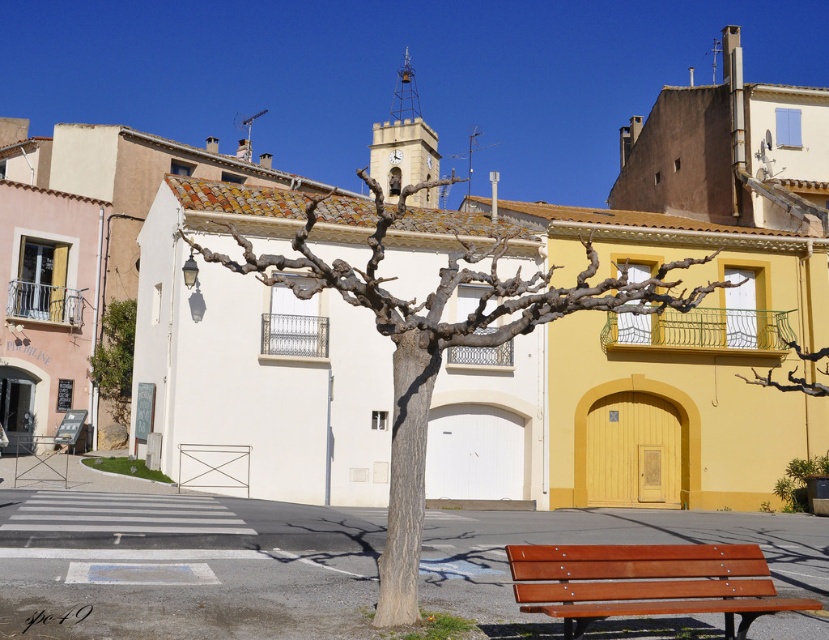
Question: Does brown wooden bench at lower right have a smaller size compared to green leafy tree at left?

Choices:
 (A) yes
 (B) no

Answer: (A)

Question: Based on their relative distances, which object is farther from the green leafy tree at left?

Choices:
 (A) bare wood tree at center
 (B) brown wooden bench at lower right

Answer: (B)

Question: Does brown wooden bench at lower right have a greater width compared to green leafy tree at left?

Choices:
 (A) no
 (B) yes

Answer: (B)

Question: Can you confirm if brown wooden bench at lower right is positioned to the right of green leafy tree at left?

Choices:
 (A) yes
 (B) no

Answer: (A)

Question: Which point is farther to the camera?

Choices:
 (A) green leafy tree at left
 (B) bare wood tree at center

Answer: (A)

Question: Which object is the closest to the brown wooden bench at lower right?

Choices:
 (A) green leafy tree at left
 (B) bare wood tree at center

Answer: (B)